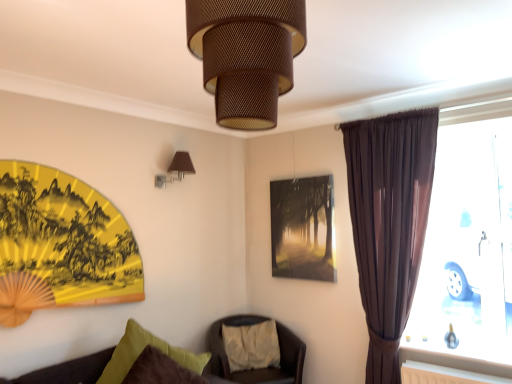
The height and width of the screenshot is (384, 512). Identify the location of brown sheer curtain at right. (389, 223).

Between matte brown lampshade at upper left, the 2th lamp positioned from the right, and velvet green pillow at lower left, arranged as the second pillow when viewed from the right, which one has more height?

velvet green pillow at lower left, arranged as the second pillow when viewed from the right.

From the image's perspective, would you say matte brown lampshade at upper left, the 2th lamp positioned from the right, is shown under velvet green pillow at lower left, acting as the first pillow starting from the left?

No, from the image's perspective, matte brown lampshade at upper left, the 2th lamp positioned from the right, is not beneath velvet green pillow at lower left, acting as the first pillow starting from the left.

Is matte brown lampshade at upper left, the 2th lamp positioned from the right, in contact with velvet green pillow at lower left, positioned as the 2th pillow in back-to-front order?

There is a gap between matte brown lampshade at upper left, the 2th lamp positioned from the right, and velvet green pillow at lower left, positioned as the 2th pillow in back-to-front order.

Is point (183, 153) behind point (106, 370)?

That is True.

Is brown textured lampshade at upper center, the first lamp when ordered from front to back, wider than brown sheer curtain at right?

Correct, the width of brown textured lampshade at upper center, the first lamp when ordered from front to back, exceeds that of brown sheer curtain at right.

Can you tell me how much brown textured lampshade at upper center, positioned as the first lamp in right-to-left order, and brown sheer curtain at right differ in facing direction?

2.84 degrees.

Is brown textured lampshade at upper center, placed as the second lamp when sorted from left to right, not within brown sheer curtain at right?

Yes, brown textured lampshade at upper center, placed as the second lamp when sorted from left to right, is located beyond the bounds of brown sheer curtain at right.

Is brown textured lampshade at upper center, the first lamp when ordered from front to back, facing away from brown sheer curtain at right?

Correct, brown textured lampshade at upper center, the first lamp when ordered from front to back, is looking away from brown sheer curtain at right.

Which of these two, white cotton pillow at center, the 2th pillow when ordered from left to right, or satin brown curtain at right, is wider?

white cotton pillow at center, the 2th pillow when ordered from left to right.

Is point (244, 329) behind point (483, 363)?

Yes, point (244, 329) is behind point (483, 363).

Is white cotton pillow at center, marked as the 1th pillow in a right-to-left arrangement, not inside satin brown curtain at right?

Yes, white cotton pillow at center, marked as the 1th pillow in a right-to-left arrangement, is outside of satin brown curtain at right.

Considering the sizes of white cotton pillow at center, which is the second pillow from front to back, and satin brown curtain at right in the image, is white cotton pillow at center, which is the second pillow from front to back, bigger or smaller than satin brown curtain at right?

white cotton pillow at center, which is the second pillow from front to back, is smaller than satin brown curtain at right.

Is white cotton pillow at center, which is the second pillow from front to back, beside brown sheer curtain at right?

They are not placed beside each other.

Can you tell me how much white cotton pillow at center, which is the second pillow from front to back, and brown sheer curtain at right differ in facing direction?

63.7 degrees.

Which of these two, white cotton pillow at center, marked as the 1th pillow in a right-to-left arrangement, or brown sheer curtain at right, is wider?

white cotton pillow at center, marked as the 1th pillow in a right-to-left arrangement.

Who is smaller, white cotton pillow at center, marked as the 1th pillow in a right-to-left arrangement, or brown sheer curtain at right?

With smaller size is white cotton pillow at center, marked as the 1th pillow in a right-to-left arrangement.

Which point is more forward, (x=217, y=349) or (x=308, y=185)?

The point (x=308, y=185) is closer to the camera.

Which is behind, brown leather chair at center or matte glass picture frame at center?

matte glass picture frame at center is more distant.

From a real-world perspective, who is located lower, brown leather chair at center or matte glass picture frame at center?

brown leather chair at center.

Would you say brown leather chair at center is inside or outside matte glass picture frame at center?

brown leather chair at center is located beyond the bounds of matte glass picture frame at center.

Based on their positions, is velvet green pillow at lower left, acting as the first pillow starting from the left, located to the left or right of satin brown curtain at right?

velvet green pillow at lower left, acting as the first pillow starting from the left, is to the left of satin brown curtain at right.

Is velvet green pillow at lower left, the 1th pillow from the front, oriented towards satin brown curtain at right?

No.

Considering the positions of objects velvet green pillow at lower left, arranged as the second pillow when viewed from the right, and satin brown curtain at right in the image provided, who is in front, velvet green pillow at lower left, arranged as the second pillow when viewed from the right, or satin brown curtain at right?

velvet green pillow at lower left, arranged as the second pillow when viewed from the right.

What's the angular difference between brown textured lampshade at upper center, placed as the second lamp when sorted from left to right, and white cotton pillow at center, the 2th pillow when ordered from left to right,'s facing directions?

The angle between the facing direction of brown textured lampshade at upper center, placed as the second lamp when sorted from left to right, and the facing direction of white cotton pillow at center, the 2th pillow when ordered from left to right, is 66.5 degrees.

From the image's perspective, count 2nd lamps upward from the white cotton pillow at center, placed as the first pillow when sorted from back to front, and point to it. Please provide its 2D coordinates.

[(246, 55)]

Choose the correct answer: Is brown textured lampshade at upper center, positioned as the first lamp in right-to-left order, inside white cotton pillow at center, marked as the 1th pillow in a right-to-left arrangement, or outside it?

brown textured lampshade at upper center, positioned as the first lamp in right-to-left order, is spatially situated outside white cotton pillow at center, marked as the 1th pillow in a right-to-left arrangement.

Is brown textured lampshade at upper center, the first lamp when ordered from front to back, in front of or behind white cotton pillow at center, placed as the first pillow when sorted from back to front, in the image?

Clearly, brown textured lampshade at upper center, the first lamp when ordered from front to back, is in front of white cotton pillow at center, placed as the first pillow when sorted from back to front.

The width and height of the screenshot is (512, 384). Identify the location of lamp on the left of velvet green pillow at lower left, acting as the first pillow starting from the left. (176, 169).

Where is `curtain below the brown textured lampshade at upper center, placed as the second lamp when sorted from left to right (from a real-world perspective)`? curtain below the brown textured lampshade at upper center, placed as the second lamp when sorted from left to right (from a real-world perspective) is located at coordinates (389, 223).

Looking at the image, which one is located further to brown sheer curtain at right, velvet green pillow at lower left, acting as the first pillow starting from the left, or white cotton pillow at center, marked as the 1th pillow in a right-to-left arrangement?

velvet green pillow at lower left, acting as the first pillow starting from the left, is further to brown sheer curtain at right.

Estimate the real-world distances between objects in this image. Which object is further from brown leather chair at center, white cotton pillow at center, which is the second pillow from front to back, or matte glass picture frame at center?

Based on the image, matte glass picture frame at center appears to be further to brown leather chair at center.

Estimate the real-world distances between objects in this image. Which object is closer to brown sheer curtain at right, brown leather chair at center or matte glass picture frame at center?

Among the two, matte glass picture frame at center is located nearer to brown sheer curtain at right.

Based on their spatial positions, is matte glass picture frame at center or brown sheer curtain at right closer to velvet green pillow at lower left, the 1th pillow from the front?

matte glass picture frame at center is positioned closer to the anchor velvet green pillow at lower left, the 1th pillow from the front.

From the image, which object appears to be nearer to matte brown lampshade at upper left, which is the 1th lamp in left-to-right order, satin brown curtain at right or matte glass picture frame at center?

Among the two, matte glass picture frame at center is located nearer to matte brown lampshade at upper left, which is the 1th lamp in left-to-right order.

Looking at the image, which one is located closer to satin brown curtain at right, brown leather chair at center or brown sheer curtain at right?

brown sheer curtain at right lies closer to satin brown curtain at right than the other object.

When comparing their distances from brown textured lampshade at upper center, placed as the second lamp when sorted from left to right, does brown sheer curtain at right or matte glass picture frame at center seem closer?

brown sheer curtain at right lies closer to brown textured lampshade at upper center, placed as the second lamp when sorted from left to right, than the other object.

Based on their spatial positions, is satin brown curtain at right or brown sheer curtain at right closer to brown leather chair at center?

brown sheer curtain at right lies closer to brown leather chair at center than the other object.

Where is `pillow located between brown textured lampshade at upper center, the first lamp when ordered from front to back, and matte brown lampshade at upper left, which is the 1th lamp in left-to-right order, in the depth direction`? The height and width of the screenshot is (384, 512). pillow located between brown textured lampshade at upper center, the first lamp when ordered from front to back, and matte brown lampshade at upper left, which is the 1th lamp in left-to-right order, in the depth direction is located at coordinates (129, 352).

You are a GUI agent. You are given a task and a screenshot of the screen. Output one action in this format:
    pyautogui.click(x=<x>, y=<y>)
    Task: Click on the lamp between velvet green pillow at lower left, positioned as the 2th pillow in back-to-front order, and satin brown curtain at right from left to right
    This screenshot has width=512, height=384.
    Given the screenshot: What is the action you would take?
    pyautogui.click(x=246, y=55)

Locate an element on the screen. picture frame between white cotton pillow at center, which is the second pillow from front to back, and satin brown curtain at right is located at coordinates (303, 228).

Where is `chair situated between matte brown lampshade at upper left, which is the 1th lamp in left-to-right order, and satin brown curtain at right from left to right`? chair situated between matte brown lampshade at upper left, which is the 1th lamp in left-to-right order, and satin brown curtain at right from left to right is located at coordinates (258, 369).